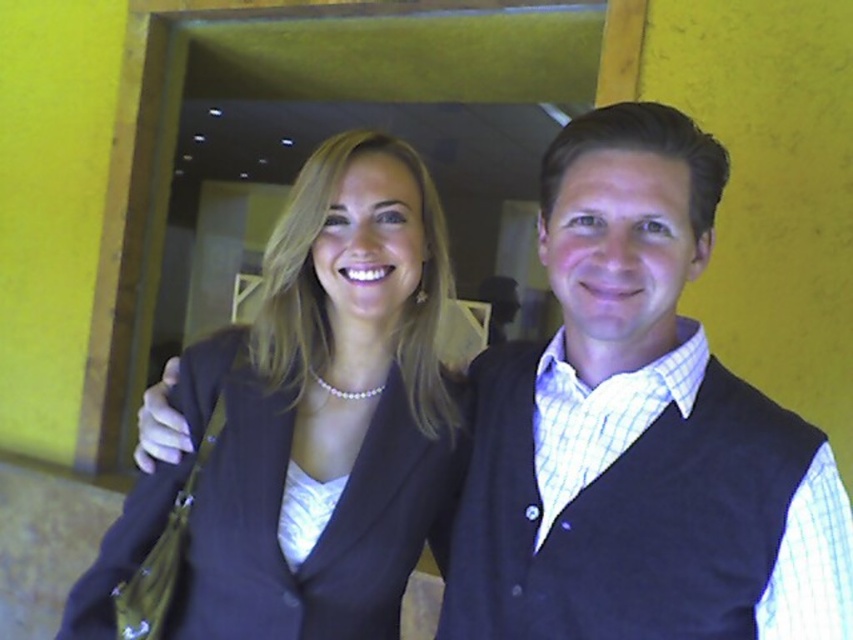
Based on the photo, you are a photographer positioned in front of the two people. You want to focus your camera on the white satin dress at center without the matte black blazer at center blocking the view. Is this possible given their positions?

The matte black blazer at center is closer to the viewer than the white satin dress at center, so it would block the view of the white satin dress at center. Therefore, focusing on the white satin dress at center without obstruction is not possible.

You are standing in the room and want to hand a document to the person wearing the dark blue wool vest at right. Based on their position in the image, which direction should you move to approach them?

The dark blue wool vest at right is located at point (642, 506), so you should move towards the right side of the room to approach the person wearing the dark blue wool vest at right.